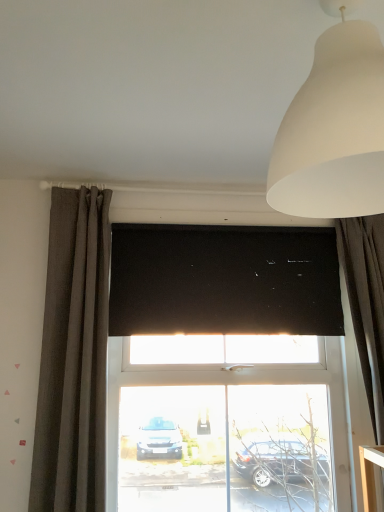
Question: From a real-world perspective, is black matte window screen at center above or below dark gray textured curtain at left, positioned as the 2th curtain in right-to-left order?

Choices:
 (A) above
 (B) below

Answer: (A)

Question: From the image's perspective, is black matte window screen at center above or below dark gray textured curtain at left, positioned as the 2th curtain in right-to-left order?

Choices:
 (A) below
 (B) above

Answer: (B)

Question: Which is farther from the dark gray textured curtain at left, the 1th curtain viewed from the left?

Choices:
 (A) black matte window screen at center
 (B) dark grey fabric curtain at right, the second curtain from the left
 (C) white matte lampshade at upper right

Answer: (C)

Question: Considering the real-world distances, which object is closest to the dark gray textured curtain at left, positioned as the 2th curtain in right-to-left order?

Choices:
 (A) dark grey fabric curtain at right, the second curtain from the left
 (B) black matte window screen at center
 (C) white matte lampshade at upper right

Answer: (B)